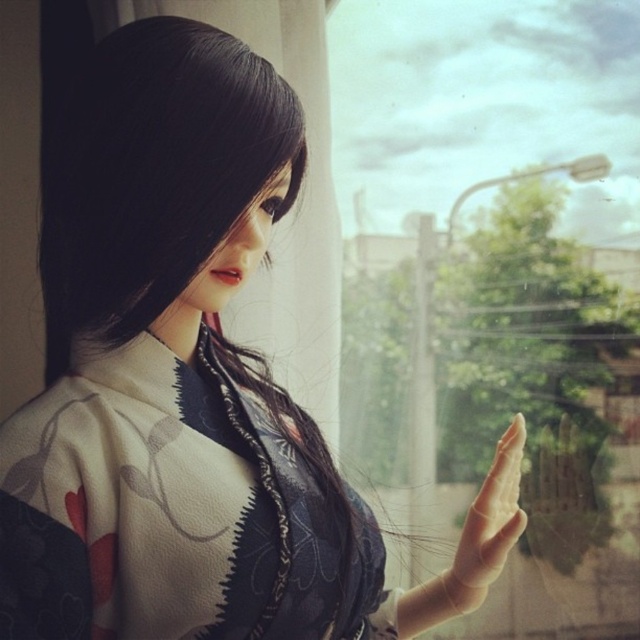
Question: Which object appears closest to the camera in this image?

Choices:
 (A) transparent glass window at center
 (B) smooth skin hand at center
 (C) white silk kimono at center

Answer: (C)

Question: Which object is the farthest from the transparent glass window at center?

Choices:
 (A) smooth skin hand at center
 (B) white silk kimono at center

Answer: (B)

Question: Which of the following is the closest to the observer?

Choices:
 (A) (74, 604)
 (B) (492, 486)
 (C) (468, 160)

Answer: (A)

Question: Is transparent glass window at center smaller than white silk kimono at center?

Choices:
 (A) no
 (B) yes

Answer: (A)

Question: Does transparent glass window at center lie behind white silk kimono at center?

Choices:
 (A) yes
 (B) no

Answer: (A)

Question: Is white silk kimono at center bigger than smooth skin hand at center?

Choices:
 (A) no
 (B) yes

Answer: (B)